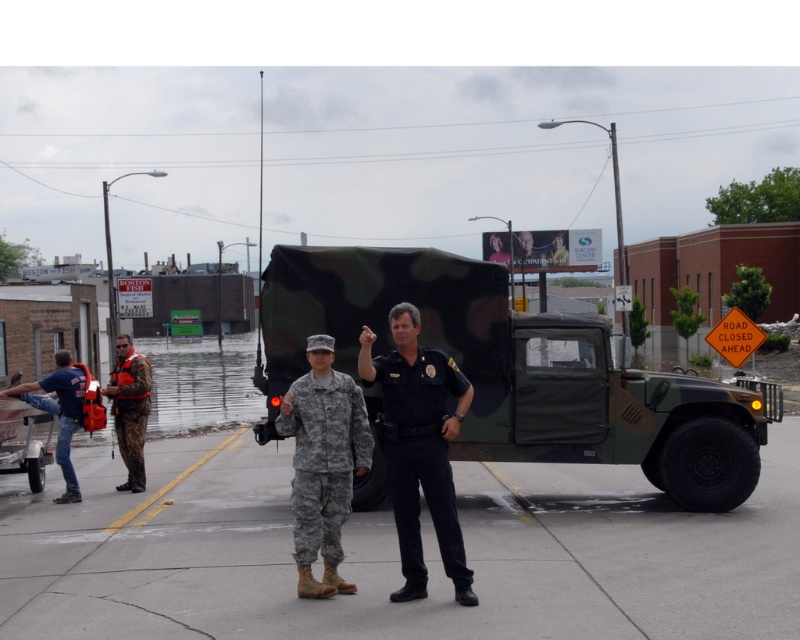
What do you see at coordinates (420, 448) in the screenshot? I see `dark blue uniform at center` at bounding box center [420, 448].

How distant is dark blue uniform at center from camouflage fabric uniform at center?

The distance of dark blue uniform at center from camouflage fabric uniform at center is 18.25 inches.

Between point (398, 483) and point (358, 396), which one is positioned behind?

The point (358, 396) is more distant.

Find the location of `dark blue uniform at center`. dark blue uniform at center is located at coordinates (420, 448).

Based on the photo, which is below, camouflage fabric uniform at center or blue denim jeans at lower left?

Positioned lower is blue denim jeans at lower left.

Does point (350, 392) lie behind point (78, 403)?

That is False.

This screenshot has width=800, height=640. What do you see at coordinates (324, 464) in the screenshot? I see `camouflage fabric uniform at center` at bounding box center [324, 464].

The image size is (800, 640). I want to click on camouflage fabric uniform at center, so click(324, 464).

Is camouflage fabric truck at center to the left of camouflage fabric uniform at left from the viewer's perspective?

Incorrect, camouflage fabric truck at center is not on the left side of camouflage fabric uniform at left.

Can you confirm if camouflage fabric truck at center is positioned to the right of camouflage fabric uniform at left?

Correct, you'll find camouflage fabric truck at center to the right of camouflage fabric uniform at left.

This screenshot has height=640, width=800. What are the coordinates of `camouflage fabric truck at center` in the screenshot? It's located at (517, 371).

Where is `camouflage fabric truck at center`? The width and height of the screenshot is (800, 640). camouflage fabric truck at center is located at coordinates (517, 371).